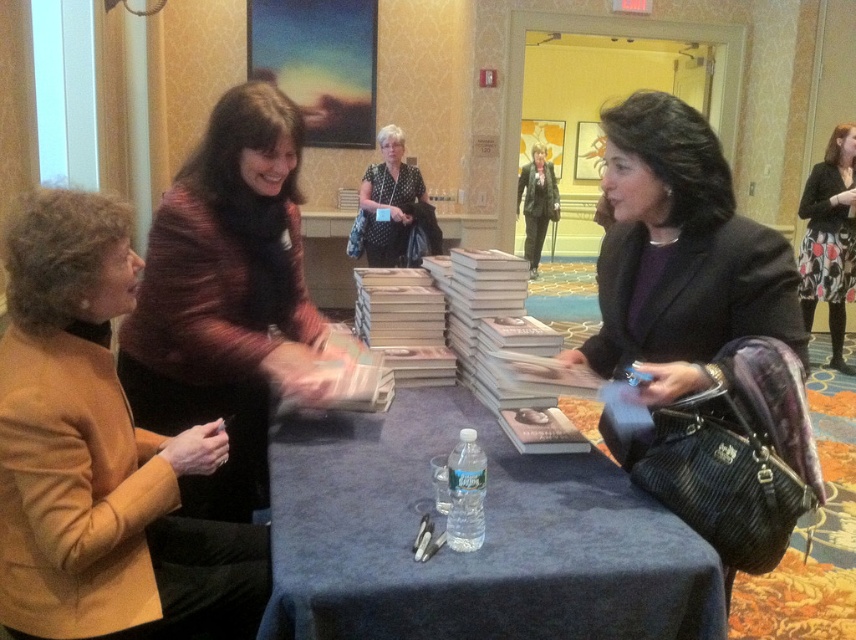
Question: Which object is the closest to the matte black blazer at center?

Choices:
 (A) blue fabric table at center
 (B) striped wool sweater at center

Answer: (A)

Question: Is matte black blazer at center above polka dot blouse at center?

Choices:
 (A) yes
 (B) no

Answer: (B)

Question: Which point is closer to the camera taking this photo?

Choices:
 (A) (x=477, y=577)
 (B) (x=642, y=228)
 (C) (x=809, y=304)

Answer: (A)

Question: Observing the image, what is the correct spatial positioning of blue fabric table at center in reference to matte gold jacket at left?

Choices:
 (A) above
 (B) below

Answer: (B)

Question: Does matte gold jacket at left have a smaller size compared to matte black blazer at center?

Choices:
 (A) no
 (B) yes

Answer: (B)

Question: Which point appears closest to the camera in this image?

Choices:
 (A) (834, 248)
 (B) (16, 426)
 (C) (712, 310)

Answer: (B)